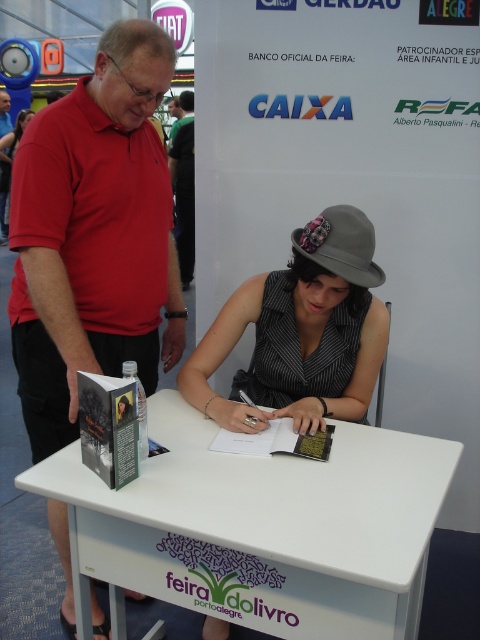
What object is located at the coordinates point (301, 332)?

The gray felt hat at center is located at point (301, 332).

Looking at this image, you are organizing a photo shoot at the book fair and need to position two models. One will wear the matte red shirt at left and the other the matte black dress at center. The photographer wants to ensure that the larger garment does not overwhelm the smaller one in the frame. Which model should be placed closer to the camera to maintain visual balance?

The matte red shirt at left is bigger than the matte black dress at center. To maintain visual balance, the model wearing the matte black dress at center should be placed closer to the camera so that its smaller size appears more prominent, counterbalancing the larger matte red shirt at left in the background.

You are a photographer at the book fair. You want to take a photo of the gray felt hat at center and the matte red shirt at left so that both are fully visible. Based on their heights, which object should be placed closer to the camera to ensure both are in frame without cropping?

The gray felt hat at center is shorter than the matte red shirt at left. To ensure both are fully visible without cropping, place the shorter gray felt hat at center closer to the camera so its height matches the taller matte red shirt at left in the frame.